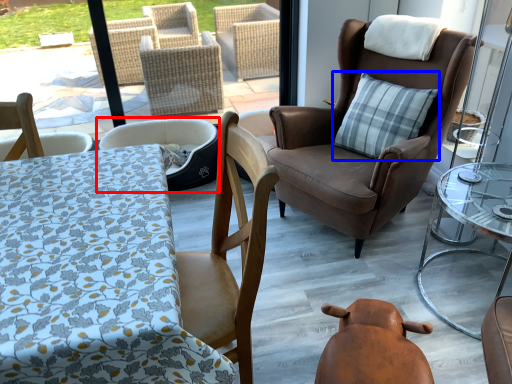
Question: Among these objects, which one is farthest to the camera, chair (highlighted by a red box) or pillow (highlighted by a blue box)?

Choices:
 (A) chair
 (B) pillow

Answer: (A)